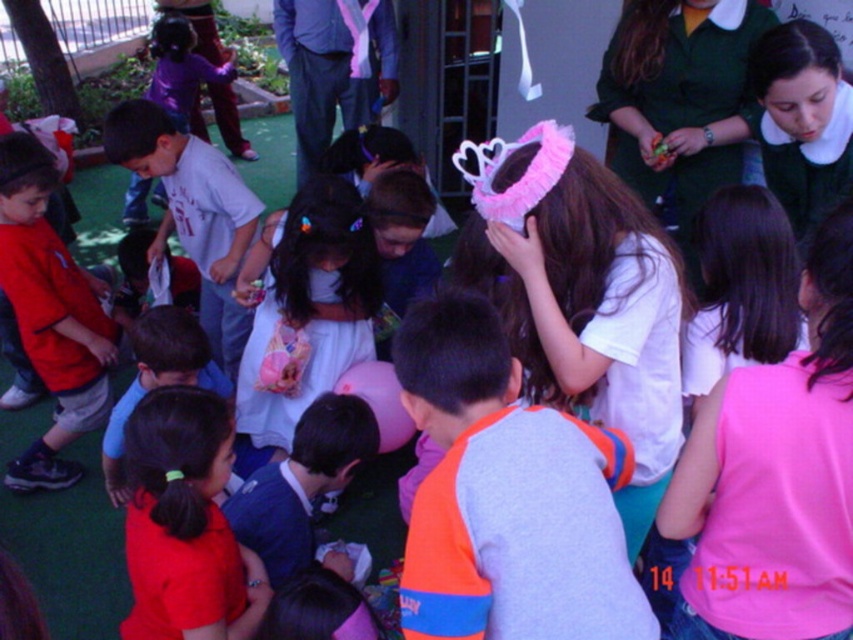
Question: Is orange fabric shirt at center closer to camera compared to pink fabric shirt at lower right?

Choices:
 (A) yes
 (B) no

Answer: (A)

Question: Observing the image, what is the correct spatial positioning of pink fabric shirt at lower right in reference to white satin dress at center?

Choices:
 (A) above
 (B) below

Answer: (B)

Question: Does pink fabric shirt at lower right appear over pink fluffy crown at center?

Choices:
 (A) yes
 (B) no

Answer: (B)

Question: Which of the following is the closest to the observer?

Choices:
 (A) matte red shirt at lower left
 (B) matte red shirt at left

Answer: (A)

Question: Estimate the real-world distances between objects in this image. Which object is farther from the pink fabric shirt at lower right?

Choices:
 (A) matte red shirt at lower left
 (B) orange fabric shirt at center
 (C) matte red shirt at left

Answer: (C)

Question: Among these points, which one is farthest from the camera?

Choices:
 (A) (550, 248)
 (B) (62, 285)
 (C) (236, 624)

Answer: (B)